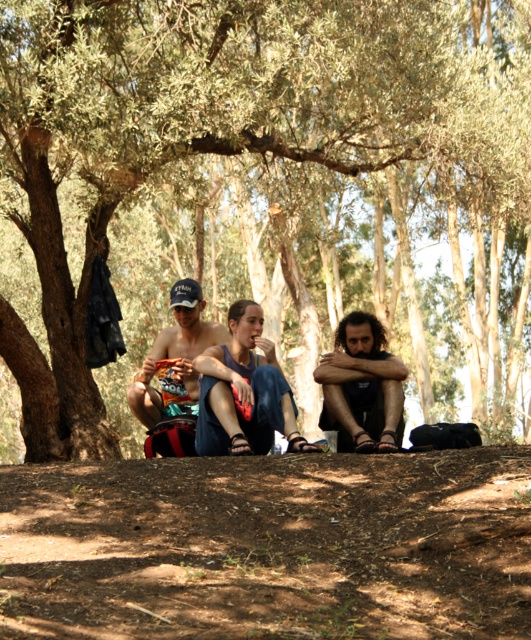
Question: Is dark brown hair at center thinner than matte black cap at center?

Choices:
 (A) no
 (B) yes

Answer: (B)

Question: Is blue denim jeans at center closer to camera compared to dark brown hair at center?

Choices:
 (A) no
 (B) yes

Answer: (B)

Question: Estimate the real-world distances between objects in this image. Which object is farther from the blue denim jeans at center?

Choices:
 (A) matte black cap at center
 (B) dark brown hair at center
 (C) green leafy tree at center

Answer: (C)

Question: Which point is farther from the camera taking this photo?

Choices:
 (A) (207, 323)
 (B) (244, 332)
 (C) (28, 216)

Answer: (C)

Question: Which is nearer to the matte black cap at center?

Choices:
 (A) green leafy tree at center
 (B) blue denim jeans at center

Answer: (B)

Question: Does green leafy tree at center appear under blue denim jeans at center?

Choices:
 (A) no
 (B) yes

Answer: (A)